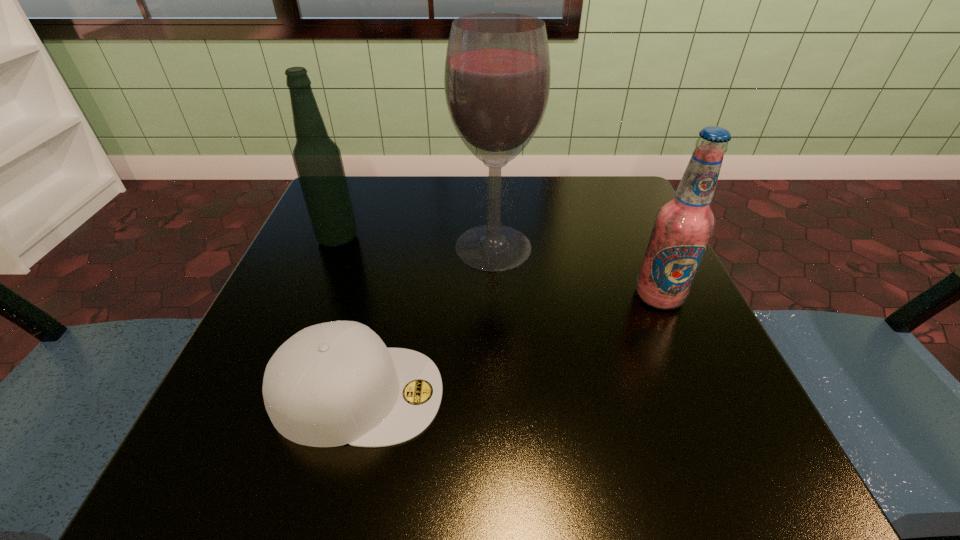
Locate an element on the screen. vacant region located on the front-facing side of the nearest object is located at coordinates (698, 394).

In order to click on object present at the near edge in this screenshot , I will do `click(335, 383)`.

The width and height of the screenshot is (960, 540). Identify the location of alcohol that is at the left edge. (317, 159).

This screenshot has width=960, height=540. What are the coordinates of `cap situated at the left edge` in the screenshot? It's located at (335, 383).

Locate an element on the screen. object that is at the right edge is located at coordinates (683, 226).

Find the location of `object at the far left corner`. object at the far left corner is located at coordinates (317, 159).

Find the location of a particular element. This screenshot has width=960, height=540. object at the near left corner is located at coordinates [x=335, y=383].

In the image, there is a desktop. At what (x,y) coordinates should I click in order to perform the action: click on vacant region at the far edge. Please return your answer as a coordinate pair (x, y). This screenshot has height=540, width=960. Looking at the image, I should click on (459, 186).

What are the coordinates of `vacant position at the near edge of the desktop` in the screenshot? It's located at (621, 467).

Image resolution: width=960 pixels, height=540 pixels. Find the location of `vacant space at the left edge`. vacant space at the left edge is located at coordinates (305, 238).